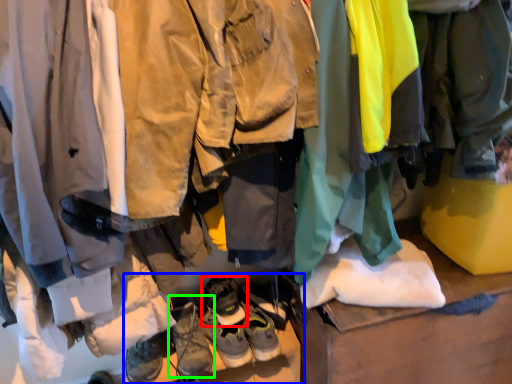
Question: Based on their relative distances, which object is nearer to footwear (highlighted by a red box)? Choose from footwear (highlighted by a blue box) and footwear (highlighted by a green box).

Choices:
 (A) footwear
 (B) footwear

Answer: (B)